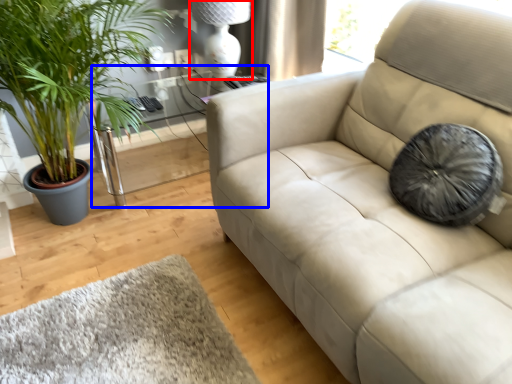
Question: Which object appears closest to the camera in this image, lamp (highlighted by a red box) or table (highlighted by a blue box)?

Choices:
 (A) lamp
 (B) table

Answer: (B)